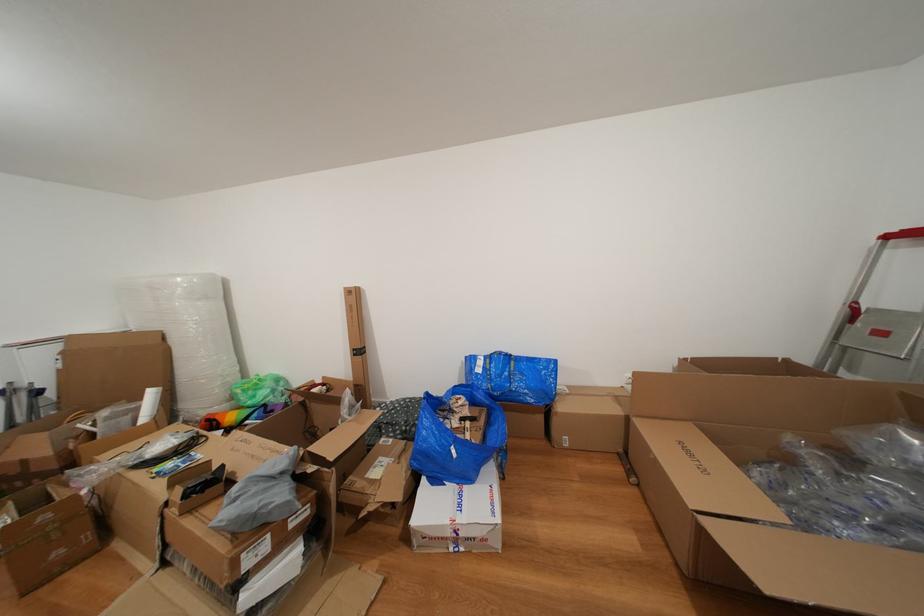
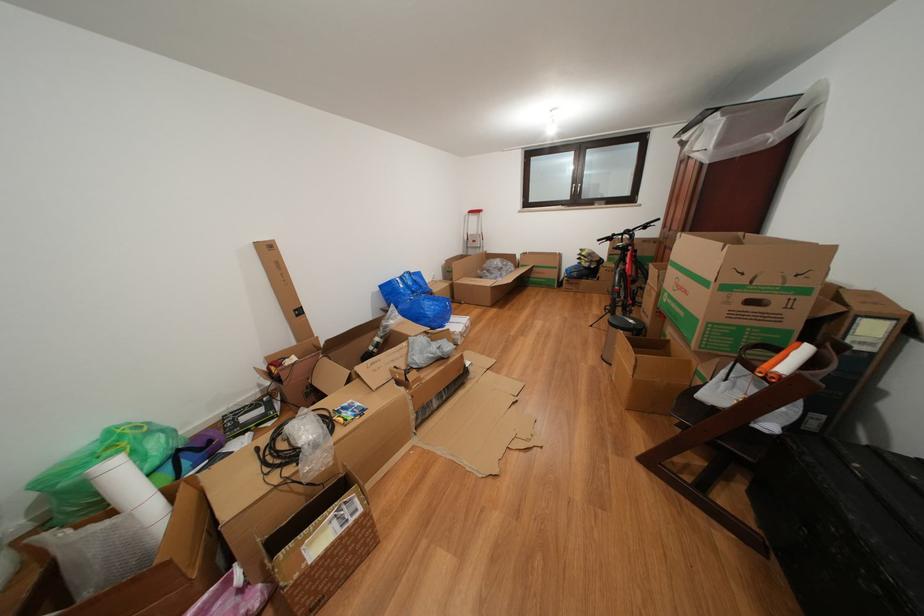
The point at (487, 376) is marked in the first image. Where is the corresponding point in the second image?

(409, 291)